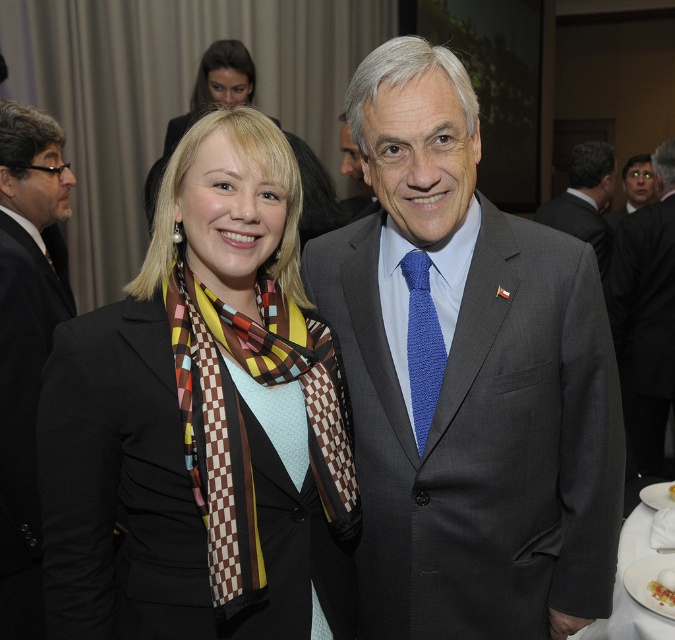
Does blue knitted tie at center have a greater width compared to matte black suit at upper right?

No.

Is point (408, 324) positioned after point (626, 180)?

No, it is in front of (626, 180).

Which is behind, point (410, 406) or point (651, 186)?

Point (651, 186)

Image resolution: width=675 pixels, height=640 pixels. Find the location of `blue knitted tie at center`. blue knitted tie at center is located at coordinates (423, 342).

Between matte black blazer at center and blue knitted tie at center, which one is positioned higher?

blue knitted tie at center is above.

Where is `matte black blazer at center`? matte black blazer at center is located at coordinates (202, 420).

Is black suit at left thinner than dark gray suit at center?

Indeed, black suit at left has a lesser width compared to dark gray suit at center.

The width and height of the screenshot is (675, 640). What do you see at coordinates (26, 342) in the screenshot? I see `black suit at left` at bounding box center [26, 342].

Does point (7, 307) come in front of point (645, 396)?

That is True.

Image resolution: width=675 pixels, height=640 pixels. What are the coordinates of `black suit at left` in the screenshot? It's located at (26, 342).